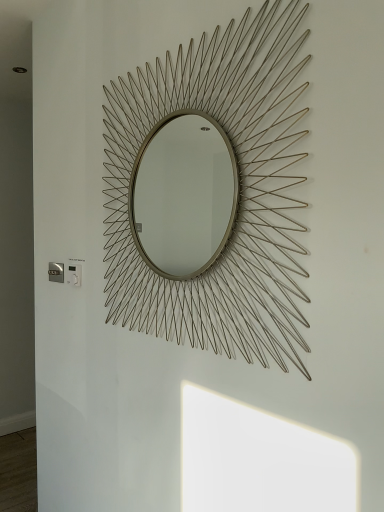
Question: Is gold wire sunburst mirror at center spatially inside white plastic electric outlet at lower left, which is counted as the 1th electric outlet, starting from the right, or outside of it?

Choices:
 (A) outside
 (B) inside

Answer: (A)

Question: Is point (233, 24) positioned closer to the camera than point (67, 278)?

Choices:
 (A) farther
 (B) closer

Answer: (B)

Question: Estimate the real-world distances between objects in this image. Which object is farther from the gold wire sunburst mirror at center?

Choices:
 (A) metallic silver electric outlet at lower left, positioned as the second electric outlet in right-to-left order
 (B) white plastic electric outlet at lower left, the 2th electric outlet when ordered from back to front

Answer: (A)

Question: Considering the real-world distances, which object is closest to the gold wire sunburst mirror at center?

Choices:
 (A) white plastic electric outlet at lower left, which is counted as the 1th electric outlet, starting from the right
 (B) metallic silver electric outlet at lower left, which appears as the 1th electric outlet when viewed from the back

Answer: (A)